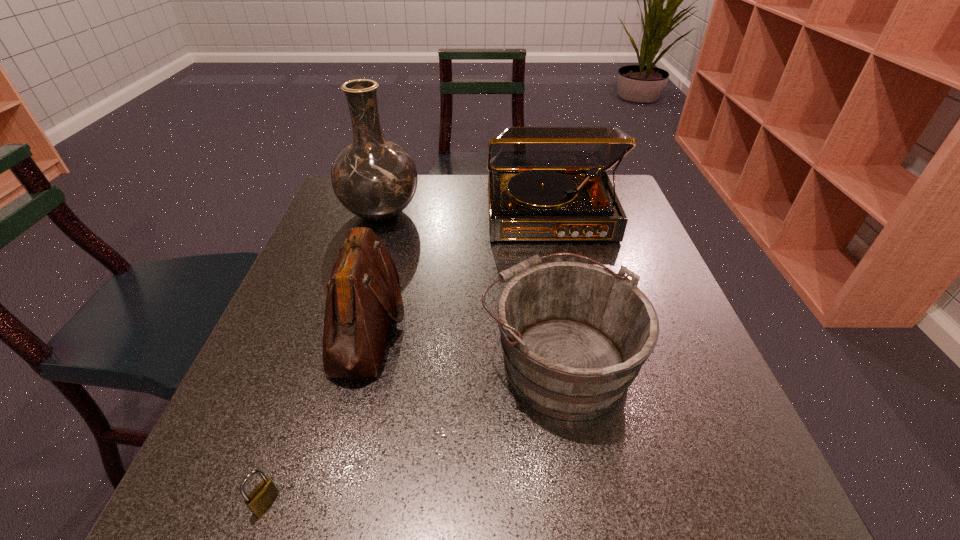
The image size is (960, 540). Identify the location of blank area located on the back of the shortest object. (304, 395).

You are a GUI agent. You are given a task and a screenshot of the screen. Output one action in this format:
    pyautogui.click(x=<x>, y=<y>)
    Task: Click on the vase at the far edge
    
    Given the screenshot: What is the action you would take?
    pyautogui.click(x=376, y=179)

Where is `record player at the far edge`? This screenshot has height=540, width=960. record player at the far edge is located at coordinates (545, 183).

This screenshot has height=540, width=960. Find the location of `object that is at the near edge`. object that is at the near edge is located at coordinates (264, 494).

What are the coordinates of `vase positioned at the left edge` in the screenshot? It's located at (376, 179).

At what (x,y) coordinates should I click in order to perform the action: click on shoulder bag at the left edge. Please return your answer as a coordinate pair (x, y). The width and height of the screenshot is (960, 540). Looking at the image, I should click on (363, 292).

The image size is (960, 540). What are the coordinates of `padlock at the left edge` in the screenshot? It's located at (264, 494).

At what (x,y) coordinates should I click in order to perform the action: click on record player that is at the right edge. Please return your answer as a coordinate pair (x, y). The image size is (960, 540). Looking at the image, I should click on (545, 183).

I want to click on wine bucket present at the right edge, so click(574, 336).

Identify the location of object at the far left corner. (376, 179).